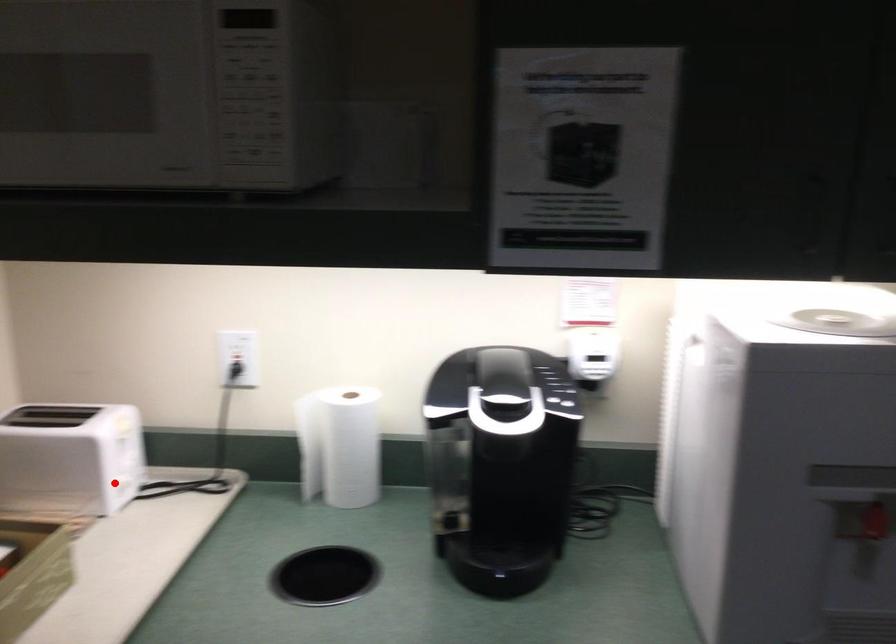
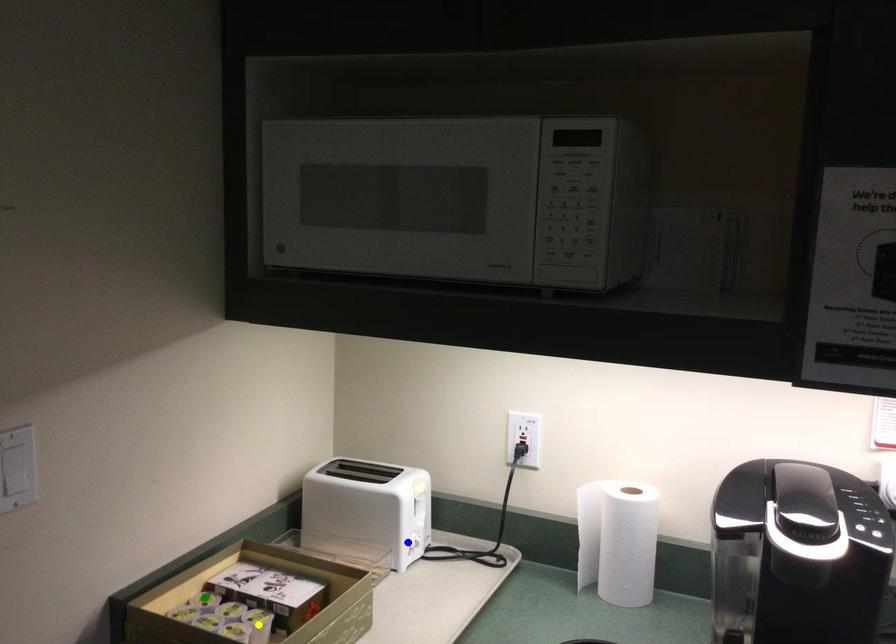
Question: I am providing you with two images of the same scene from different viewpoints. A red point is marked on the first image. You are given multiple points on the second image. Which mark in image 2 goes with the point in image 1?

Choices:
 (A) green point
 (B) blue point
 (C) yellow point

Answer: (B)